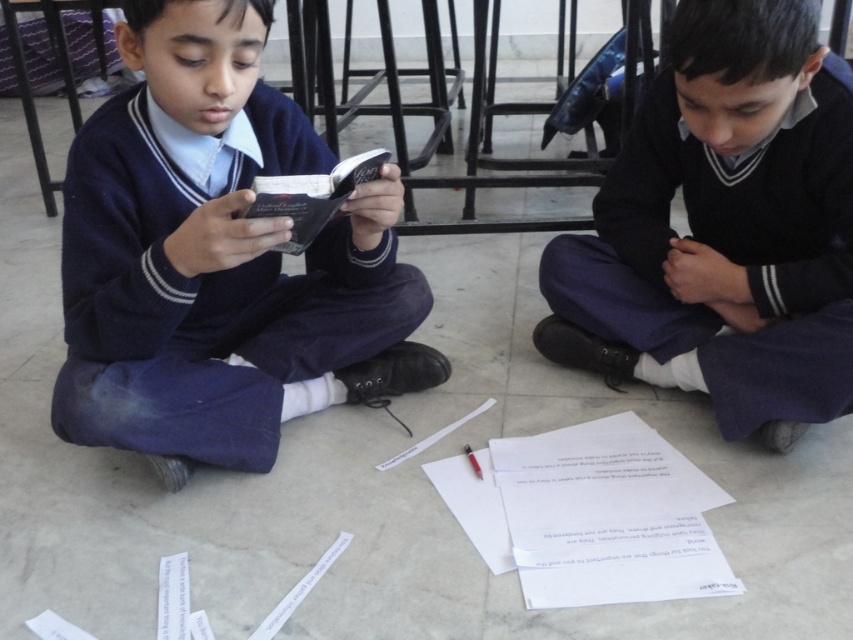
Between point (231, 392) and point (677, 362), which one is positioned behind?

Point (677, 362)

Based on the photo, can you confirm if matte black book at center is thinner than dark blue sweater at center?

No, matte black book at center is not thinner than dark blue sweater at center.

The width and height of the screenshot is (853, 640). What do you see at coordinates (218, 259) in the screenshot? I see `matte black book at center` at bounding box center [218, 259].

At what (x,y) coordinates should I click in order to perform the action: click on matte black book at center. Please return your answer as a coordinate pair (x, y). The height and width of the screenshot is (640, 853). Looking at the image, I should click on (218, 259).